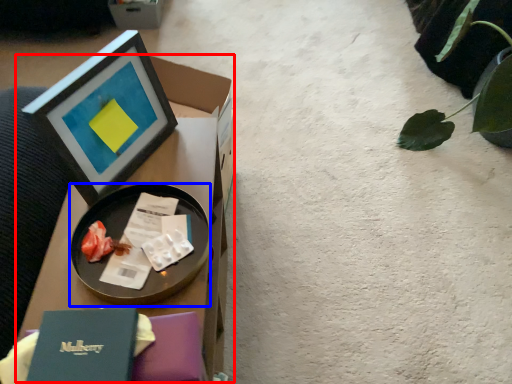
Question: Which object is closer to the camera taking this photo, table (highlighted by a red box) or tableware (highlighted by a blue box)?

Choices:
 (A) table
 (B) tableware

Answer: (A)